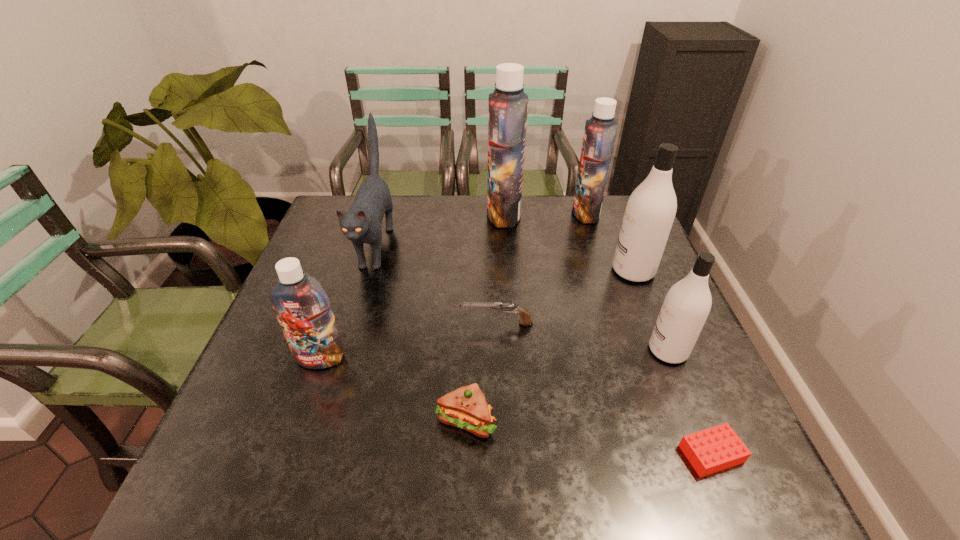
In the image, there is a desktop. Where is `blank space at the far edge`? blank space at the far edge is located at coordinates coord(420,215).

At what (x,y) coordinates should I click in order to perform the action: click on vacant region at the near edge of the desktop. Please return your answer as a coordinate pair (x, y). The image size is (960, 540). Looking at the image, I should click on (649, 461).

In the image, there is a desktop. Where is `vacant space at the left edge`? vacant space at the left edge is located at coordinates (353, 266).

You are a GUI agent. You are given a task and a screenshot of the screen. Output one action in this format:
    pyautogui.click(x=<x>, y=<y>)
    Task: Click on the free location at the right edge of the desktop
    
    Given the screenshot: What is the action you would take?
    pyautogui.click(x=652, y=285)

You are a GUI agent. You are given a task and a screenshot of the screen. Output one action in this format:
    pyautogui.click(x=<x>, y=<y>)
    Task: Click on the empty space that is in between the smaller white shampoo and the fifth nearest object
    The width and height of the screenshot is (960, 540).
    Given the screenshot: What is the action you would take?
    pyautogui.click(x=583, y=337)

Where is `free space between the gun and the sandwich`? Image resolution: width=960 pixels, height=540 pixels. free space between the gun and the sandwich is located at coordinates (481, 372).

Find the location of a particular element. free space between the second blue shampoo from left to right and the leftmost blue shampoo is located at coordinates (412, 286).

Locate an element on the screen. vacant area that lies between the cat and the farther white shampoo is located at coordinates (505, 258).

In order to click on free space between the smaller white shampoo and the sandwich in this screenshot , I will do `click(567, 385)`.

Identify the location of free space between the Lego and the leftmost blue shampoo. This screenshot has height=540, width=960. click(516, 406).